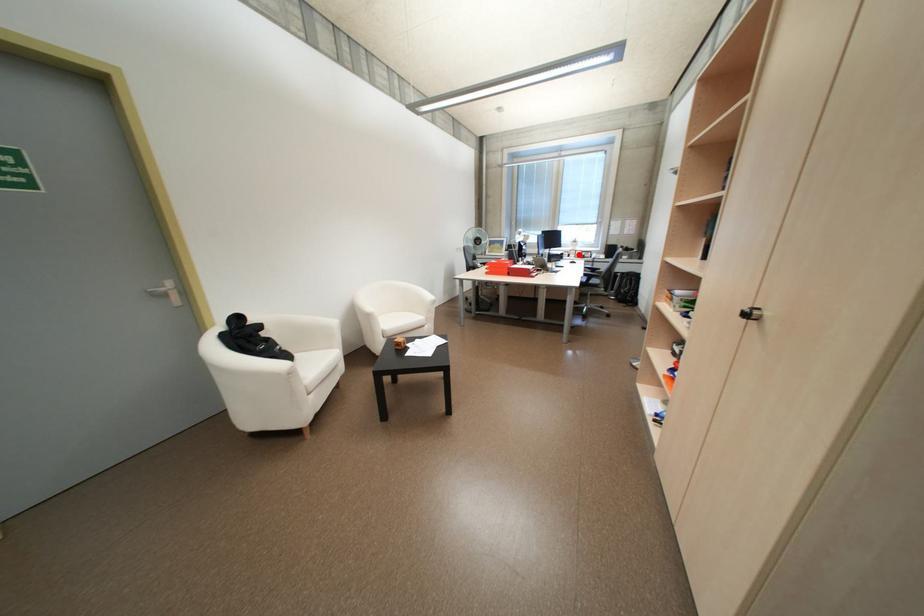
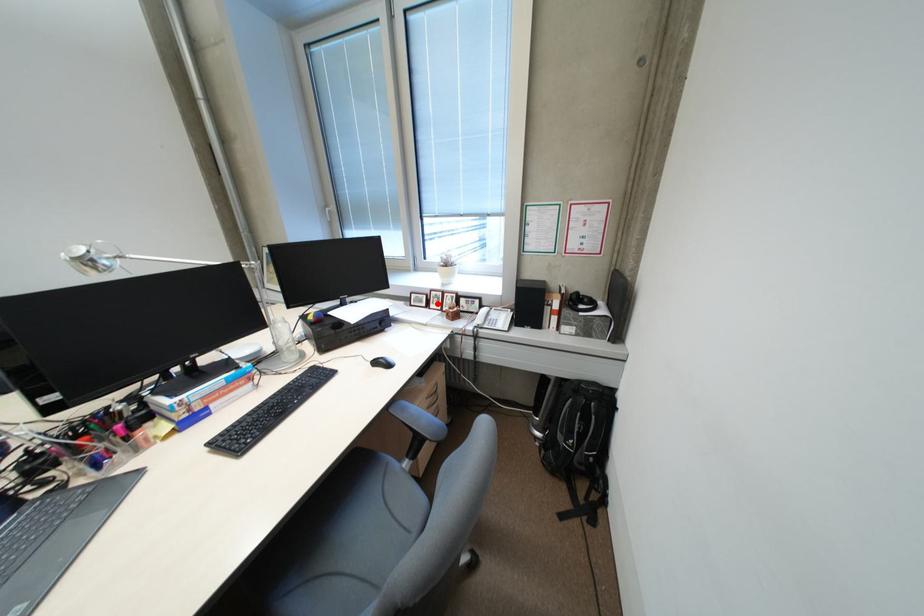
I am providing you with two images of the same scene from different viewpoints. A red point is marked on the first image and another point is marked on the second image. Is the red point in image1 aligned with the point shown in image2?

Yes